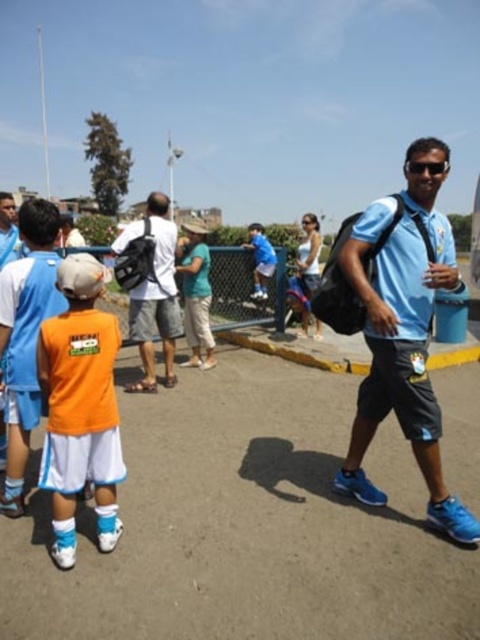
Is point (456, 540) farther from viewer compared to point (175, 374)?

No, it is in front of (175, 374).

Does point (431, 241) lie in front of point (168, 248)?

Yes, point (431, 241) is in front of point (168, 248).

The image size is (480, 640). Find the location of `light blue fabric shirt at center`. light blue fabric shirt at center is located at coordinates (405, 332).

Does light blue fabric shirt at center have a greater width compared to orange fabric shirt at left?

Yes, light blue fabric shirt at center is wider than orange fabric shirt at left.

Is light blue fabric shirt at center thinner than orange fabric shirt at left?

No, light blue fabric shirt at center is not thinner than orange fabric shirt at left.

Where is `light blue fabric shirt at center`? light blue fabric shirt at center is located at coordinates (405, 332).

Can you confirm if orange fabric shirt at left is shorter than matte black backpack at center?

Yes, orange fabric shirt at left is shorter than matte black backpack at center.

Does orange fabric shirt at left have a larger size compared to matte black backpack at center?

No, orange fabric shirt at left is not bigger than matte black backpack at center.

Is point (78, 486) farther from viewer compared to point (157, 253)?

No, (78, 486) is in front of (157, 253).

At what (x,y) coordinates should I click in order to perform the action: click on orange fabric shirt at left. Please return your answer as a coordinate pair (x, y). The height and width of the screenshot is (640, 480). Looking at the image, I should click on (81, 406).